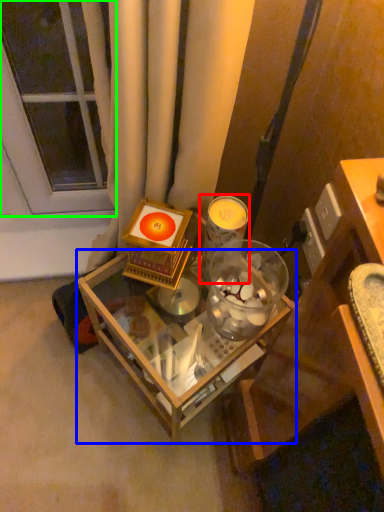
Question: Considering the real-world distances, which object is farthest from candle holder (highlighted by a red box)? table (highlighted by a blue box) or glass door (highlighted by a green box)?

Choices:
 (A) table
 (B) glass door

Answer: (B)